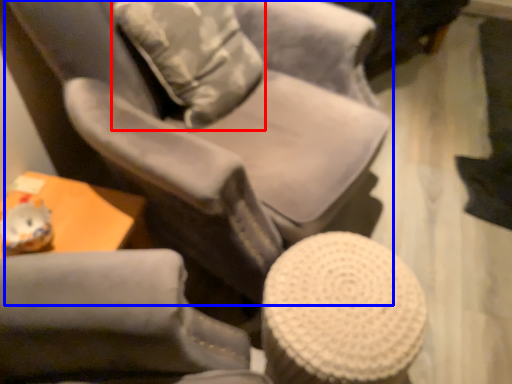
Question: Which point is closer to the camera, throw pillow (highlighted by a red box) or chair (highlighted by a blue box)?

Choices:
 (A) throw pillow
 (B) chair

Answer: (B)